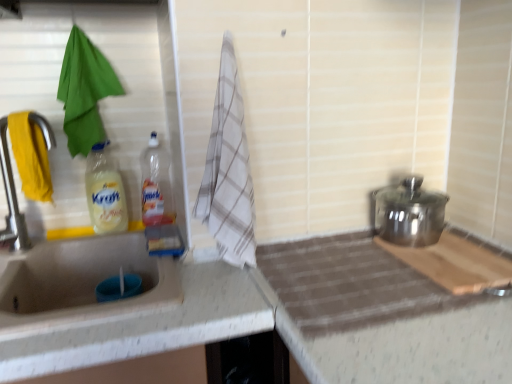
Measure the distance between white speckled countertop at lower left and camera.

A distance of 26.34 inches exists between white speckled countertop at lower left and camera.

What is the approximate width of yellow matte bottle at sink left, the second bottle when ordered from right to left?

yellow matte bottle at sink left, the second bottle when ordered from right to left, is 7.79 centimeters wide.

Locate an element on the screen. This screenshot has width=512, height=384. wooden cutting board at right is located at coordinates (456, 263).

The image size is (512, 384). Describe the element at coordinates (84, 92) in the screenshot. I see `green fabric towel at left, the 1th beach towel in the back-to-front sequence` at that location.

Measure the distance between point (94, 118) and camera.

Point (94, 118) and camera are 3.76 feet apart.

Find the location of a particular element. The image size is (512, 384). polished stainless steel pot at right is located at coordinates (409, 213).

The width and height of the screenshot is (512, 384). Describe the element at coordinates (409, 213) in the screenshot. I see `polished stainless steel pot at right` at that location.

The height and width of the screenshot is (384, 512). What are the coordinates of `white speckled countertop at lower left` in the screenshot? It's located at tap(148, 327).

Is point (110, 202) farther from viewer compared to point (395, 199)?

Yes, point (110, 202) is farther from viewer.

Which is behind, yellow matte bottle at sink left, the second bottle when ordered from right to left, or polished stainless steel pot at right?

yellow matte bottle at sink left, the second bottle when ordered from right to left, is behind.

Is yellow matte bottle at sink left, the second bottle when ordered from right to left, placed right next to polished stainless steel pot at right?

No.

Considering the sizes of yellow matte bottle at sink left, the second bottle when ordered from right to left, and polished stainless steel pot at right in the image, is yellow matte bottle at sink left, the second bottle when ordered from right to left, wider or thinner than polished stainless steel pot at right?

Considering their sizes, yellow matte bottle at sink left, the second bottle when ordered from right to left, looks slimmer than polished stainless steel pot at right.

Can you confirm if white checkered towel at center, the 2th beach towel from the back, is shorter than matte silver tap at left?

Incorrect, the height of white checkered towel at center, the 2th beach towel from the back, does not fall short of that of matte silver tap at left.

Based on their positions, is white checkered towel at center, the 2th beach towel from the back, located to the left or right of matte silver tap at left?

Based on their positions, white checkered towel at center, the 2th beach towel from the back, is located to the right of matte silver tap at left.

Does point (221, 63) appear closer or farther from the camera than point (42, 118)?

Point (221, 63).

Considering the sizes of objects white checkered towel at center, which appears as the 2th beach towel when viewed from the left, and matte silver tap at left in the image provided, who is wider, white checkered towel at center, which appears as the 2th beach towel when viewed from the left, or matte silver tap at left?

white checkered towel at center, which appears as the 2th beach towel when viewed from the left.

Considering the sizes of objects wooden cutting board at right and translucent plastic bottle at center, positioned as the 1th bottle in right-to-left order, in the image provided, who is taller, wooden cutting board at right or translucent plastic bottle at center, positioned as the 1th bottle in right-to-left order,?

With more height is translucent plastic bottle at center, positioned as the 1th bottle in right-to-left order.

Is wooden cutting board at right positioned far away from translucent plastic bottle at center, placed as the second bottle when sorted from left to right?

No, wooden cutting board at right is not far away from translucent plastic bottle at center, placed as the second bottle when sorted from left to right.

Does point (462, 252) lie behind point (170, 207)?

No, (462, 252) is closer to viewer.

Is the depth of wooden cutting board at right greater than that of translucent plastic bottle at center, positioned as the 1th bottle in right-to-left order?

No, the depth of wooden cutting board at right is less than that of translucent plastic bottle at center, positioned as the 1th bottle in right-to-left order.

Does point (92, 203) appear closer or farther from the camera than point (72, 145)?

Point (92, 203) appears to be farther away from the viewer than point (72, 145).

How far apart are yellow matte bottle at sink left, the second bottle when ordered from right to left, and green fabric towel at left, positioned as the second beach towel in front-to-back order?

14.93 centimeters.

From a real-world perspective, which bottle is the 2nd one underneath the green fabric towel at left, which is the second beach towel in right-to-left order? Please provide its 2D coordinates.

[(105, 192)]

What's the angular difference between yellow matte bottle at sink left, which is the first bottle in left-to-right order, and green fabric towel at left, positioned as the 1th beach towel in left-to-right order,'s facing directions?

0.000104 degrees.

Between white checkered towel at center, the 2th beach towel from the back, and translucent plastic bottle at center, positioned as the 1th bottle in right-to-left order, which one has larger size?

white checkered towel at center, the 2th beach towel from the back, is bigger.

From a real-world perspective, which object rests below the other?

In real-world perspective, translucent plastic bottle at center, positioned as the 1th bottle in right-to-left order, is lower.

Is white checkered towel at center, the 2th beach towel from the back, positioned with its back to translucent plastic bottle at center, positioned as the 1th bottle in right-to-left order?

That's not correct — white checkered towel at center, the 2th beach towel from the back, is not looking away from translucent plastic bottle at center, positioned as the 1th bottle in right-to-left order.

From a real-world perspective, starting from the white checkered towel at center, which appears as the 2th beach towel when viewed from the left, which bottle is the 1st one below it? Please provide its 2D coordinates.

[(156, 185)]

From a real-world perspective, which is physically above, polished stainless steel pot at right or green fabric towel at left, positioned as the second beach towel in front-to-back order?

green fabric towel at left, positioned as the second beach towel in front-to-back order.

Which point is more distant from viewer, [421,191] or [85,116]?

The point [421,191] is farther.

Is the surface of polished stainless steel pot at right in direct contact with green fabric towel at left, which is the second beach towel in right-to-left order?

polished stainless steel pot at right is not next to green fabric towel at left, which is the second beach towel in right-to-left order, and they're not touching.

Is polished stainless steel pot at right turned away from green fabric towel at left, which is the second beach towel in right-to-left order?

A: polished stainless steel pot at right does not have its back to green fabric towel at left, which is the second beach towel in right-to-left order.

In the scene shown: Which is less distant, (116, 179) or (153, 145)?

Positioned in front is point (116, 179).

Locate an element on the screen. The image size is (512, 384). bottle in front of the translucent plastic bottle at center, positioned as the 1th bottle in right-to-left order is located at coordinates (105, 192).

Can you confirm if yellow matte bottle at sink left, the second bottle when ordered from right to left, is shorter than translucent plastic bottle at center, positioned as the 1th bottle in right-to-left order?

Yes, yellow matte bottle at sink left, the second bottle when ordered from right to left, is shorter than translucent plastic bottle at center, positioned as the 1th bottle in right-to-left order.

Which object is closer to the camera, yellow matte bottle at sink left, which is the first bottle in left-to-right order, or translucent plastic bottle at center, positioned as the 1th bottle in right-to-left order?

yellow matte bottle at sink left, which is the first bottle in left-to-right order, is more forward.

Find the location of a particular element. appliance that is in front of the yellow matte bottle at sink left, the second bottle when ordered from right to left is located at coordinates (409, 213).

The image size is (512, 384). What are the coordinates of `tap below the white checkered towel at center, the 1th beach towel in the front-to-back sequence (from a real-world perspective)` in the screenshot? It's located at (11, 198).

Considering their positions, is green fabric towel at left, the 1th beach towel in the back-to-front sequence, positioned closer to matte silver tap at left than white speckled countertop at lower left?

green fabric towel at left, the 1th beach towel in the back-to-front sequence, lies closer to matte silver tap at left than the other object.

Based on their spatial positions, is green fabric towel at left, positioned as the second beach towel in front-to-back order, or matte silver tap at left further from yellow matte bottle at sink left, the second bottle when ordered from right to left?

matte silver tap at left.

When comparing their distances from wooden cutting board at right, does white checkered towel at center, which appears as the 2th beach towel when viewed from the left, or matte silver tap at left seem further?

matte silver tap at left lies further to wooden cutting board at right than the other object.

Based on their spatial positions, is white speckled countertop at lower left or matte silver tap at left closer to yellow matte bottle at sink left, which is the first bottle in left-to-right order?

matte silver tap at left is positioned closer to the anchor yellow matte bottle at sink left, which is the first bottle in left-to-right order.

Which object lies nearer to the anchor point translucent plastic bottle at center, placed as the second bottle when sorted from left to right, matte silver tap at left or wooden cutting board at right?

matte silver tap at left lies closer to translucent plastic bottle at center, placed as the second bottle when sorted from left to right, than the other object.

Looking at this image, which object lies further to the anchor point translucent plastic bottle at center, placed as the second bottle when sorted from left to right, green fabric towel at left, the 1th beach towel in the back-to-front sequence, or white speckled countertop at lower left?

white speckled countertop at lower left is positioned further to the anchor translucent plastic bottle at center, placed as the second bottle when sorted from left to right.

Estimate the real-world distances between objects in this image. Which object is further from translucent plastic bottle at center, positioned as the 1th bottle in right-to-left order, polished stainless steel pot at right or green fabric towel at left, positioned as the 1th beach towel in left-to-right order?

The object further to translucent plastic bottle at center, positioned as the 1th bottle in right-to-left order, is polished stainless steel pot at right.

Based on their spatial positions, is wooden cutting board at right or polished stainless steel pot at right closer to yellow matte bottle at sink left, which is the first bottle in left-to-right order?

polished stainless steel pot at right lies closer to yellow matte bottle at sink left, which is the first bottle in left-to-right order, than the other object.

Where is `appliance between green fabric towel at left, positioned as the second beach towel in front-to-back order, and wooden cutting board at right from left to right`? This screenshot has height=384, width=512. appliance between green fabric towel at left, positioned as the second beach towel in front-to-back order, and wooden cutting board at right from left to right is located at coordinates (409, 213).

The image size is (512, 384). What are the coordinates of `bottle situated between yellow matte bottle at sink left, which is the first bottle in left-to-right order, and wooden cutting board at right from left to right` in the screenshot? It's located at (156, 185).

This screenshot has height=384, width=512. I want to click on beach towel between white speckled countertop at lower left and wooden cutting board at right in the horizontal direction, so click(228, 170).

I want to click on appliance between translucent plastic bottle at center, positioned as the 1th bottle in right-to-left order, and wooden cutting board at right from left to right, so click(409, 213).